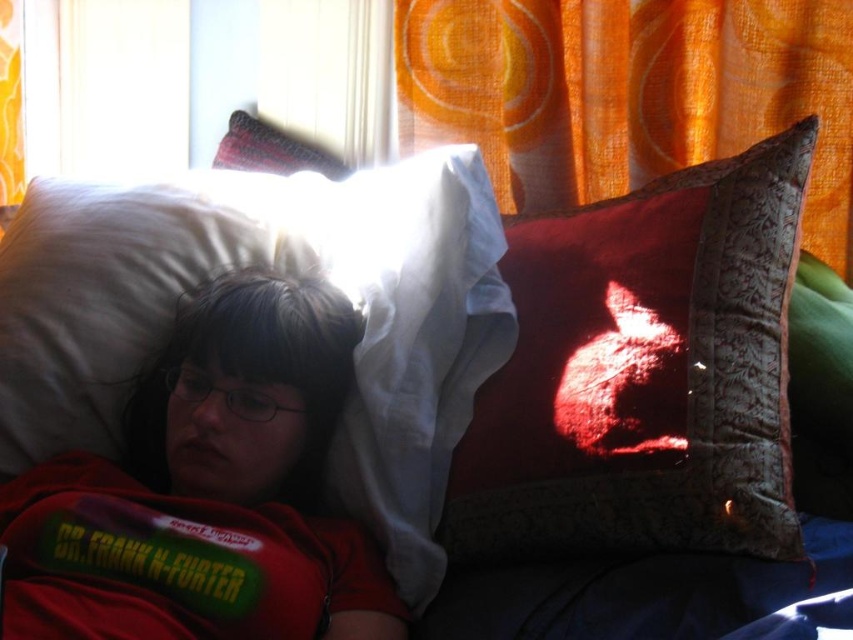
You are a photographer taking a picture of the bed scene. You notice two points marked in the image at coordinates point (120,410) and point (654,17). Which point should you focus on to ensure the closest object in the scene is sharp?

You should focus on point (120,410) because it is closer to the camera than point (654,17), ensuring the closest object in the scene is sharp.